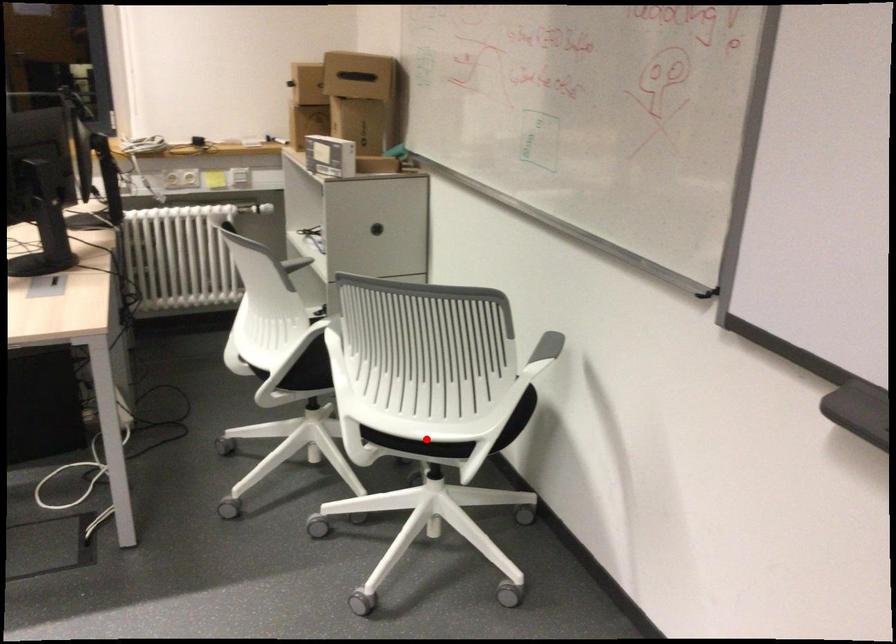
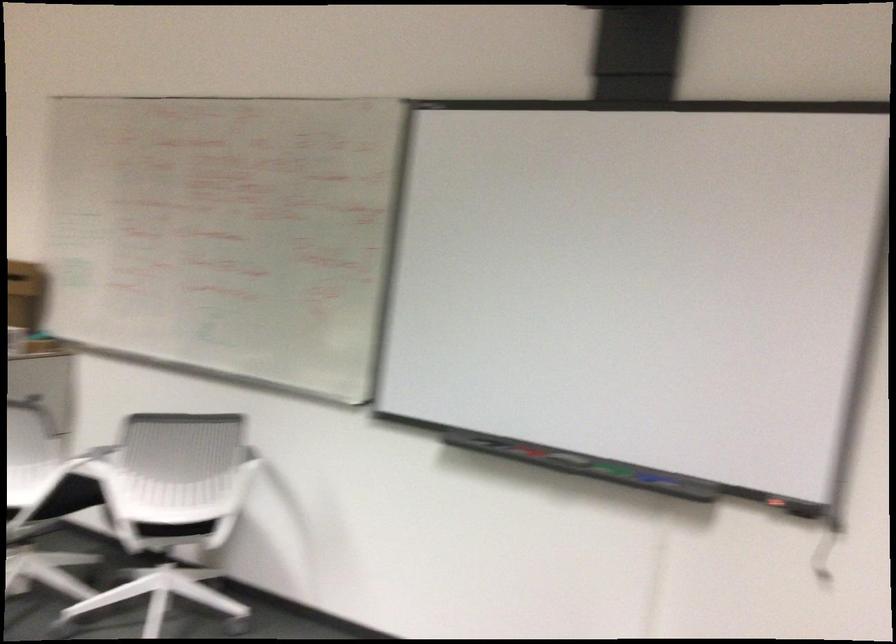
Where in the second image is the point corresponding to the highlighted location from the first image?

(175, 529)